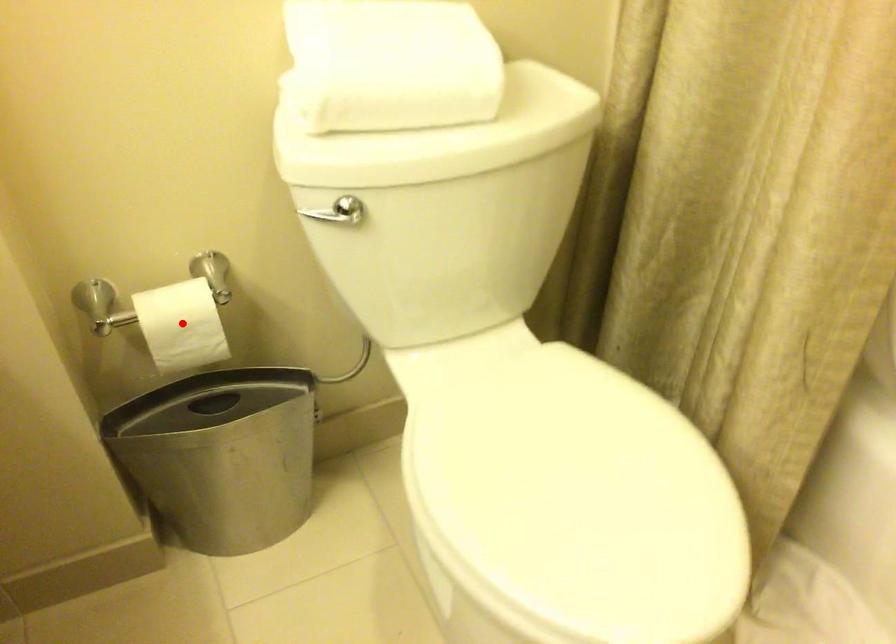
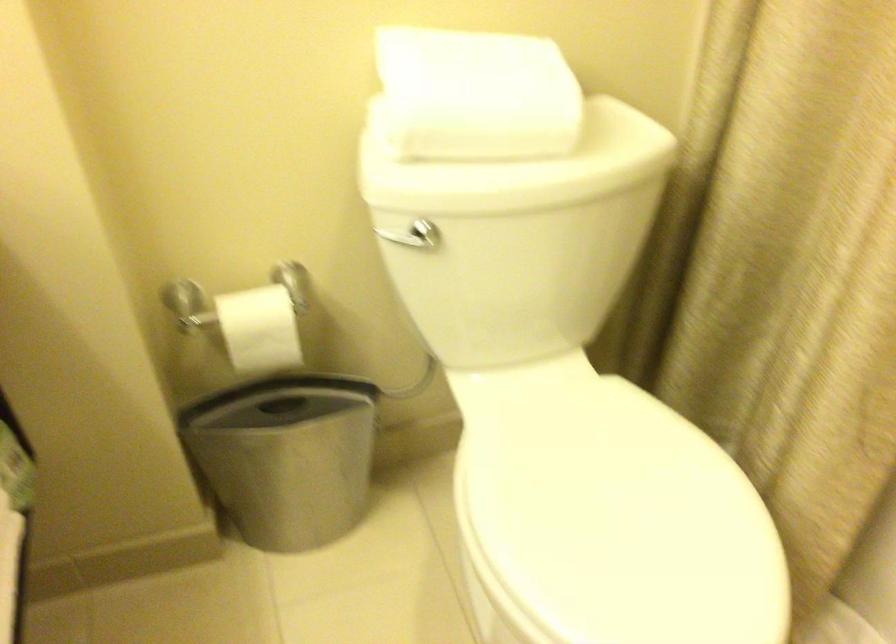
Find the pixel in the second image that matches the highlighted location in the first image.

(259, 328)